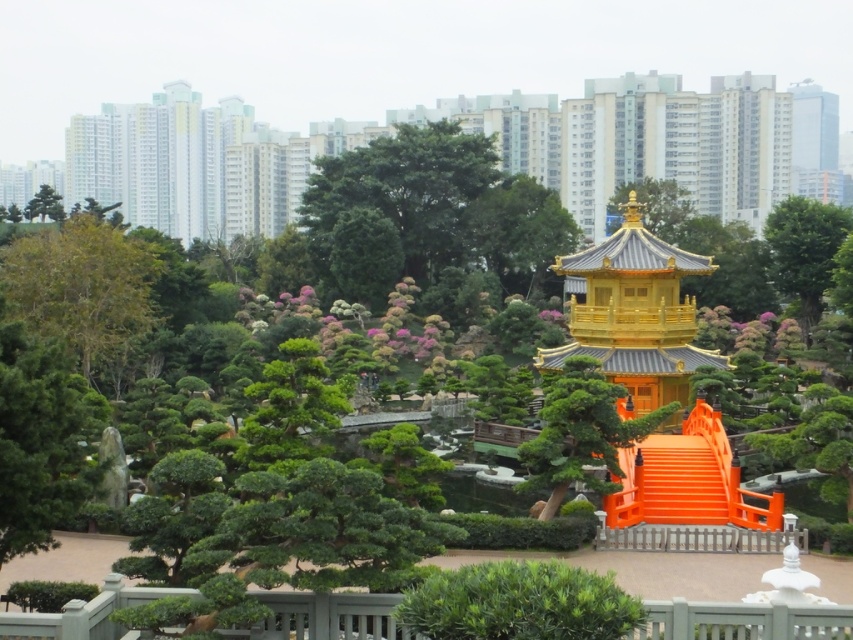
You are planning to plant a new tree in the garden. The green matte tree at lower left and the green leafy tree at center are both in the way. Which tree should you move to save more space?

The green leafy tree at center has a larger width than the green matte tree at lower left, so moving the green leafy tree at center would save more space.

You are a visitor in the garden and want to take a photo of the golden polished wood gazebo at center without the green matte tree at upper left blocking the view. Is this possible?

The golden polished wood gazebo at center is in front of the green matte tree at upper left, so the gazebo would block the tree from view. Therefore, you can take a photo of the golden polished wood gazebo at center without the green matte tree at upper left blocking the view.

You are a landscape architect designing a new garden. You have to place a golden polished wood gazebo at center and a green matte tree at upper left. Given their sizes, which object should be placed closer to the entrance to ensure visibility?

The golden polished wood gazebo at center is smaller than the green matte tree at upper left, so placing the gazebo closer to the entrance would ensure better visibility since it is smaller and less likely to block the view of the larger tree.